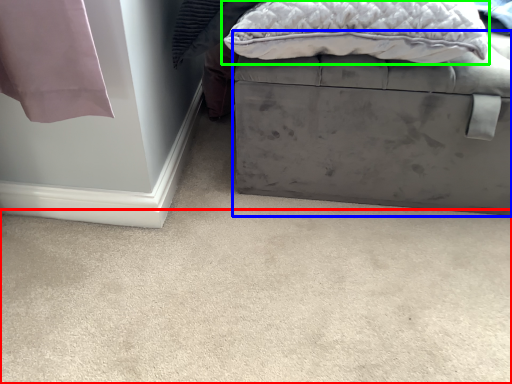
Question: Which is farther away from concrete (highlighted by a red box)? furniture (highlighted by a blue box) or pillow (highlighted by a green box)?

Choices:
 (A) furniture
 (B) pillow

Answer: (B)